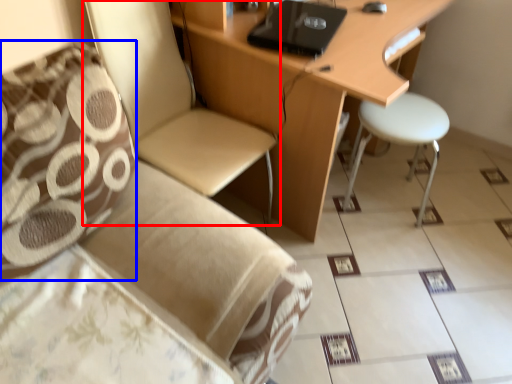
Question: Which point is further to the camera, chair (highlighted by a red box) or pillow (highlighted by a blue box)?

Choices:
 (A) chair
 (B) pillow

Answer: (A)